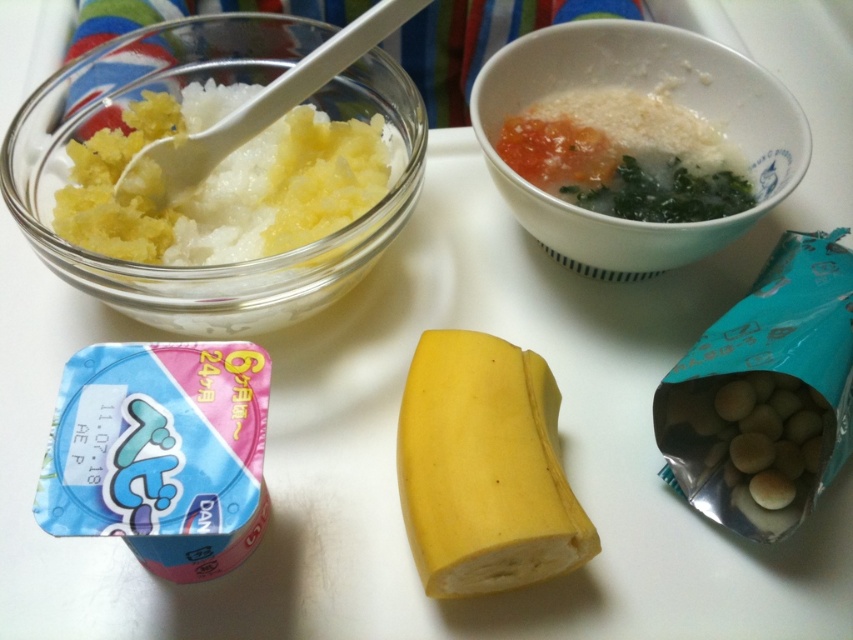
Question: Is yellow matte/skinny banana at center to the left of white plastic spoon at upper left from the viewer's perspective?

Choices:
 (A) no
 (B) yes

Answer: (A)

Question: Which point is closer to the camera?

Choices:
 (A) (422, 404)
 (B) (647, 204)

Answer: (A)

Question: Is white matte bowl at upper right positioned before white plastic spoon at upper left?

Choices:
 (A) no
 (B) yes

Answer: (B)

Question: Considering the real-world distances, which object is farthest from the yellow matte/skinny banana at center?

Choices:
 (A) white plastic spoon at upper left
 (B) white creamy soup at upper right
 (C) white matte bowl at upper right
 (D) smooth white cookies at lower right

Answer: (A)

Question: Does yellow matte/skinny banana at center have a smaller size compared to white creamy soup at upper right?

Choices:
 (A) yes
 (B) no

Answer: (A)

Question: Based on their relative distances, which object is nearer to the white matte bowl at upper right?

Choices:
 (A) smooth white cookies at lower right
 (B) yellow matte/skinny banana at center
 (C) white plastic spoon at upper left

Answer: (A)